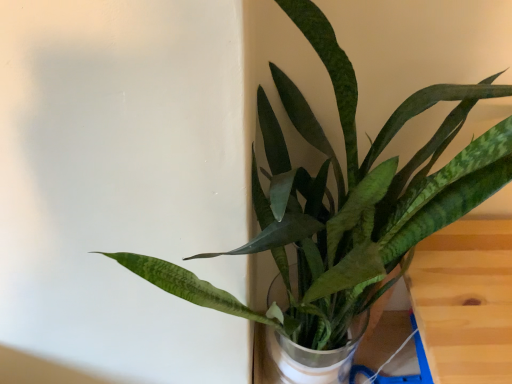
Question: Should I look upward or downward to see wooden table at lower right?

Choices:
 (A) down
 (B) up

Answer: (A)